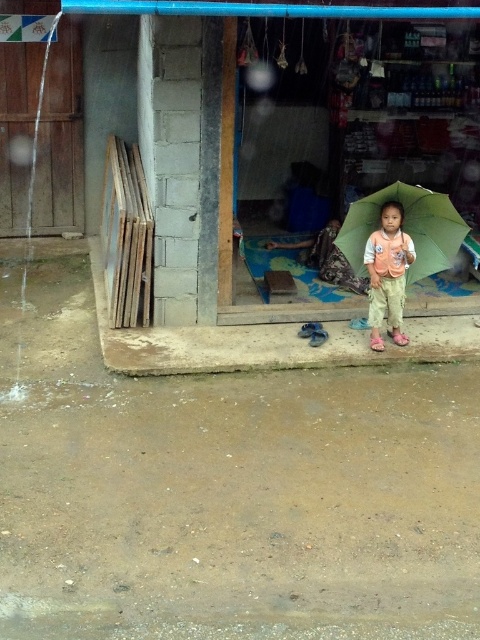
Question: Can you confirm if green matte umbrella at center is wider than matte orange vest at center?

Choices:
 (A) yes
 (B) no

Answer: (A)

Question: Can you confirm if green matte umbrella at center is positioned below matte orange vest at center?

Choices:
 (A) yes
 (B) no

Answer: (B)

Question: Which of the following is the closest to the observer?

Choices:
 (A) (408, 225)
 (B) (405, 257)

Answer: (B)

Question: Among these points, which one is farthest from the camera?

Choices:
 (A) (372, 237)
 (B) (443, 268)

Answer: (B)

Question: Does green matte umbrella at center have a greater width compared to matte orange vest at center?

Choices:
 (A) no
 (B) yes

Answer: (B)